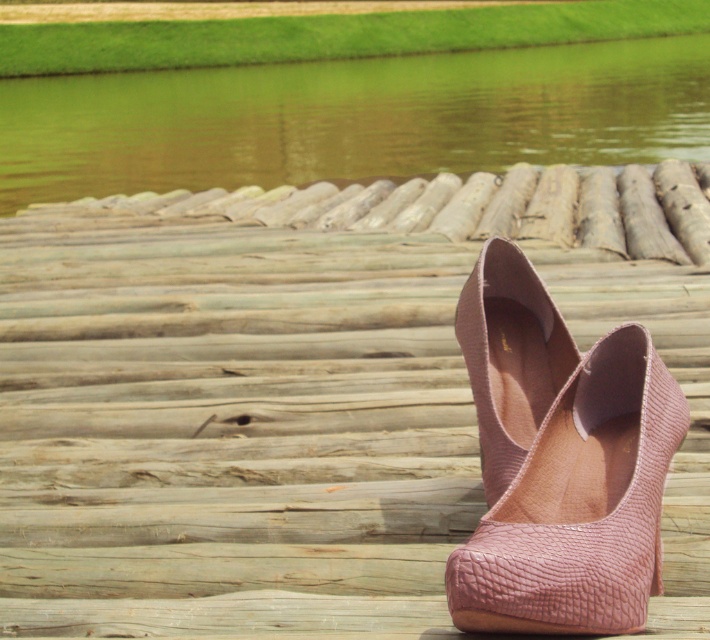
Question: Is pink snakeskin high-heeled shoe at center wider than wooden log at center?

Choices:
 (A) no
 (B) yes

Answer: (A)

Question: Is green water at upper center to the left of pink snakeskin high-heeled shoe at center from the viewer's perspective?

Choices:
 (A) no
 (B) yes

Answer: (B)

Question: Which object appears closest to the camera in this image?

Choices:
 (A) wooden log at center
 (B) pink textured shoes at center
 (C) pink snakeskin high-heeled shoe at center

Answer: (C)

Question: Which object is closer to the camera taking this photo?

Choices:
 (A) pink textured shoes at center
 (B) green water at upper center

Answer: (A)

Question: Among these objects, which one is farthest from the camera?

Choices:
 (A) pink textured shoes at center
 (B) green water at upper center
 (C) wooden log at center

Answer: (B)

Question: Can you confirm if pink textured shoes at center is positioned to the left of pink snakeskin high-heeled shoe at center?

Choices:
 (A) no
 (B) yes

Answer: (B)